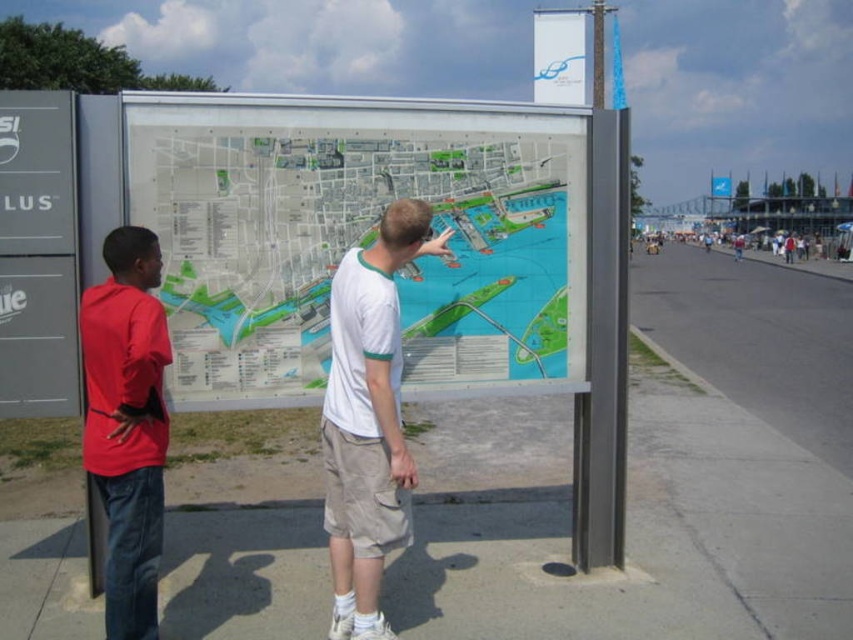
In the scene shown: You are a tourist trying to read the map but the transparent plastic map at center is partially covered by the white plastic banner at upper center. Which object is wider so that it might block more of the map?

The white plastic banner at upper center is wider than the transparent plastic map at center, so it might block more of the map.